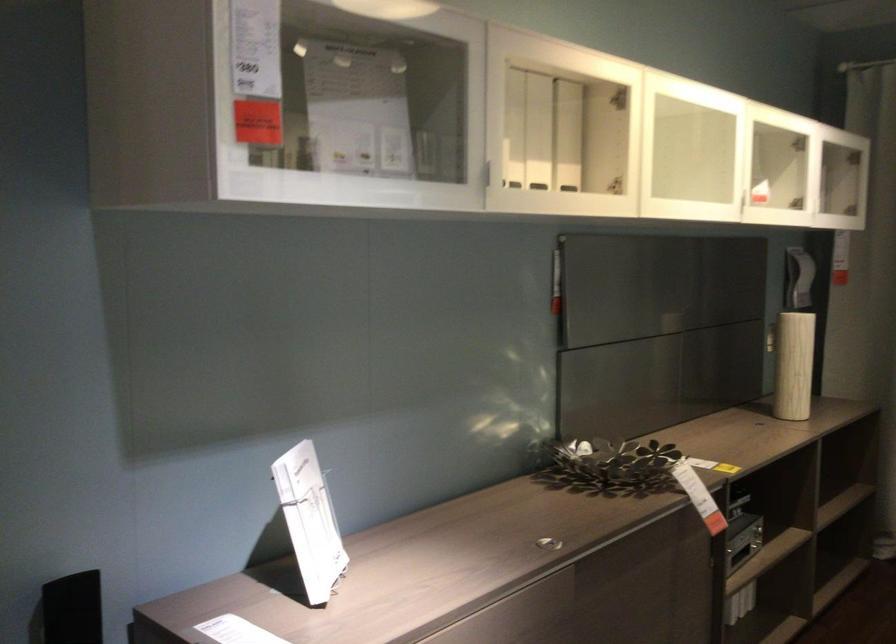
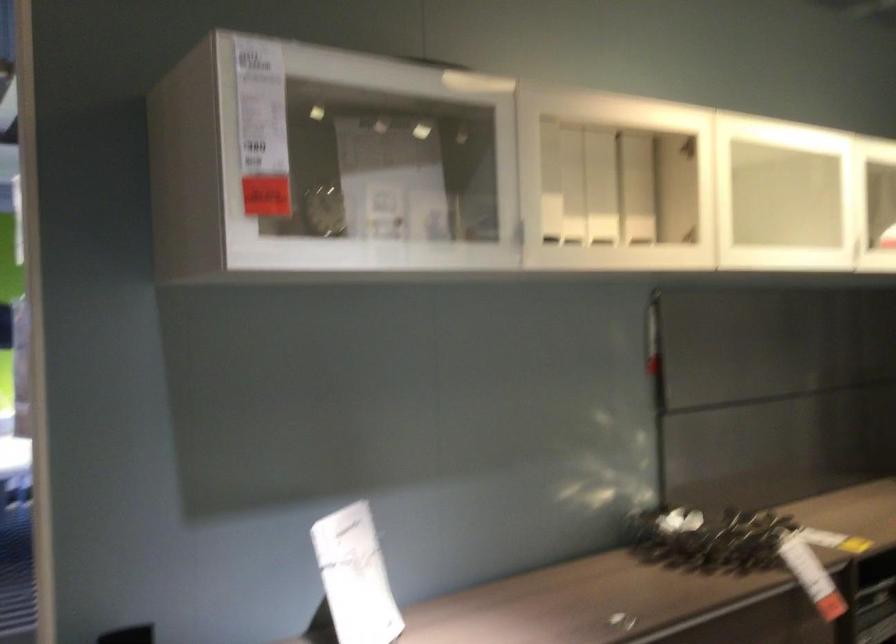
The point at (504, 122) is marked in the first image. Where is the corresponding point in the second image?

(549, 182)